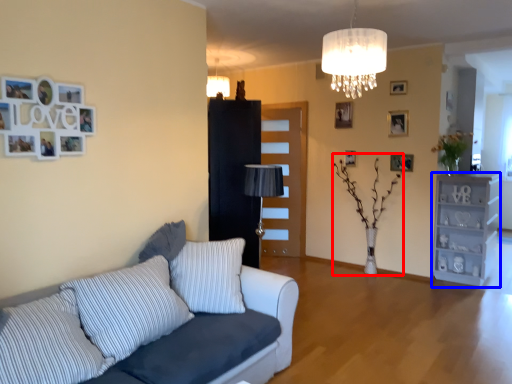
Question: Which of the following is the farthest to the observer, plant (highlighted by a red box) or shelf (highlighted by a blue box)?

Choices:
 (A) plant
 (B) shelf

Answer: (B)